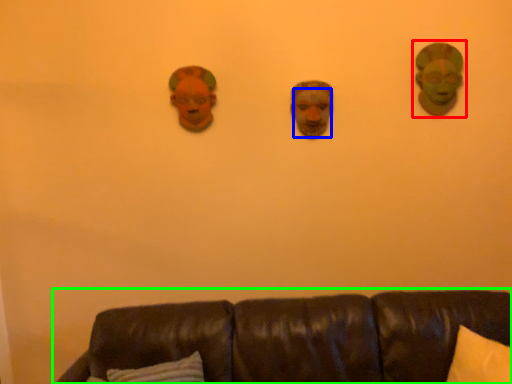
Question: Which object is the closest to the person (highlighted by a red box)? Choose among these: human face (highlighted by a blue box) or studio couch (highlighted by a green box).

Choices:
 (A) human face
 (B) studio couch

Answer: (A)